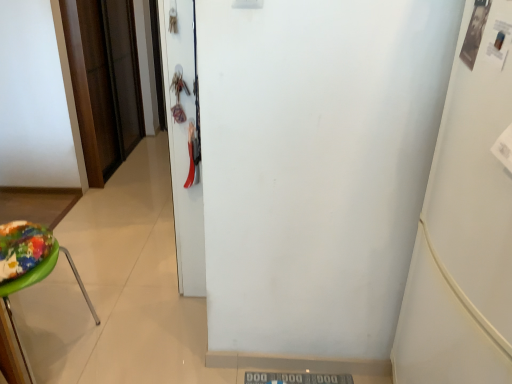
Where is `vacant space positioned to the left of white glossy door at center, which appears as the 2th door when viewed from the left`? The image size is (512, 384). vacant space positioned to the left of white glossy door at center, which appears as the 2th door when viewed from the left is located at coordinates (138, 265).